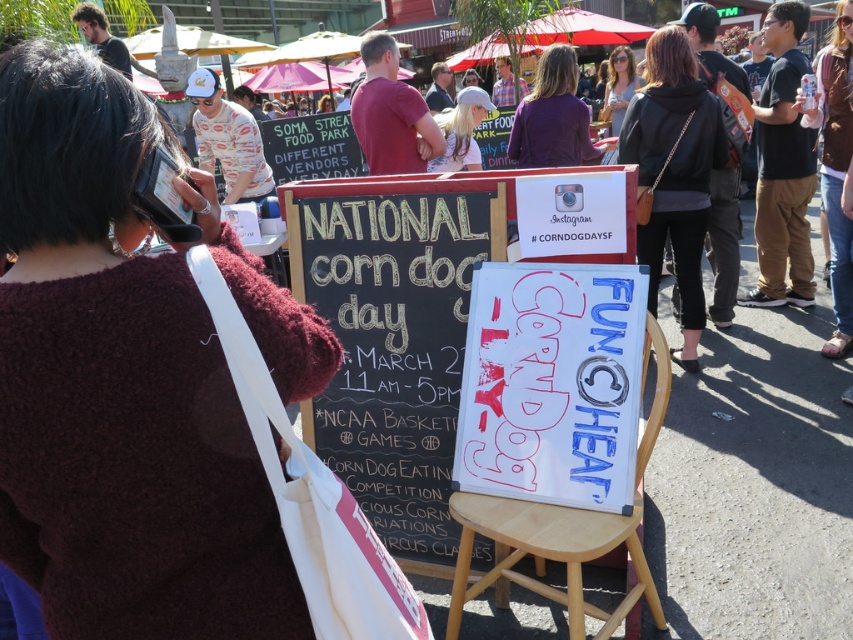
You are standing at the festival and want to take a photo that includes both the chalkboard sign and the whiteboard sign. You notice two points marked on the ground at coordinates point (674,253) and point (457,508). Which point should you stand closer to ensure both signs are in focus?

You should stand closer to point (457,508) because point (674,253) is further away from the camera, so focusing on the closer point will keep both signs in focus.

You are attending the National Corn Dog Day event and notice two items of clothing near the promotional display. The white cotton hat at center and the matte purple shirt at upper center are both displayed. Which item is positioned to the left of the other?

The white cotton hat at center is to the left of the matte purple shirt at upper center.

You are a photographer at the National Corn Dog Day event. You need to position a tripod to capture both the black leather jacket at upper center and the light brown wooden stool at center in your shot. Since the jacket is above the stool, where should you place the tripod to ensure both are in frame?

The black leather jacket at upper center is located above the light brown wooden stool at center. To capture both in the frame, position the tripod so that the camera can look downward from the jacket towards the stool, ensuring the jacket is at the top of the frame and the stool is centered below it.